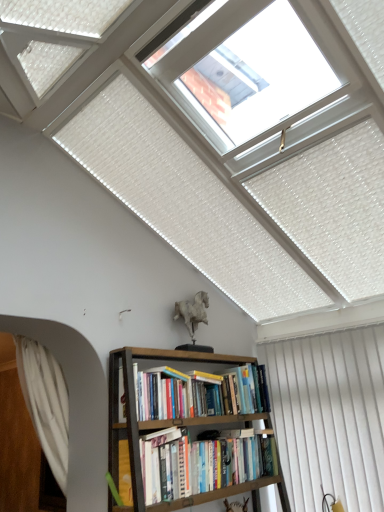
Question: Can you confirm if transparent glass skylight at upper center is smaller than hardcover books at center?

Choices:
 (A) no
 (B) yes

Answer: (A)

Question: Is transparent glass skylight at upper center positioned in front of hardcover books at center?

Choices:
 (A) no
 (B) yes

Answer: (B)

Question: Does transparent glass skylight at upper center have a lesser height compared to hardcover books at center?

Choices:
 (A) yes
 (B) no

Answer: (B)

Question: Is the depth of transparent glass skylight at upper center greater than that of hardcover books at center?

Choices:
 (A) no
 (B) yes

Answer: (A)

Question: Would you say transparent glass skylight at upper center contains hardcover books at center?

Choices:
 (A) yes
 (B) no

Answer: (B)

Question: From a real-world perspective, is transparent glass skylight at upper center located higher than hardcover books at center?

Choices:
 (A) no
 (B) yes

Answer: (B)

Question: Considering the relative sizes of transparent glass skylight at upper center and hardcover book at lower center in the image provided, is transparent glass skylight at upper center thinner than hardcover book at lower center?

Choices:
 (A) no
 (B) yes

Answer: (A)

Question: Can you confirm if transparent glass skylight at upper center is positioned to the left of hardcover book at lower center?

Choices:
 (A) yes
 (B) no

Answer: (B)

Question: Considering the relative sizes of transparent glass skylight at upper center and hardcover book at lower center in the image provided, is transparent glass skylight at upper center taller than hardcover book at lower center?

Choices:
 (A) yes
 (B) no

Answer: (A)

Question: Is hardcover book at lower center inside transparent glass skylight at upper center?

Choices:
 (A) yes
 (B) no

Answer: (B)

Question: Does transparent glass skylight at upper center have a smaller size compared to hardcover book at lower center?

Choices:
 (A) yes
 (B) no

Answer: (B)

Question: Is transparent glass skylight at upper center aimed at hardcover book at lower center?

Choices:
 (A) no
 (B) yes

Answer: (A)

Question: Is hardcover books at center at the back of white sheer curtain at left, positioned as the second curtain in right-to-left order?

Choices:
 (A) yes
 (B) no

Answer: (B)